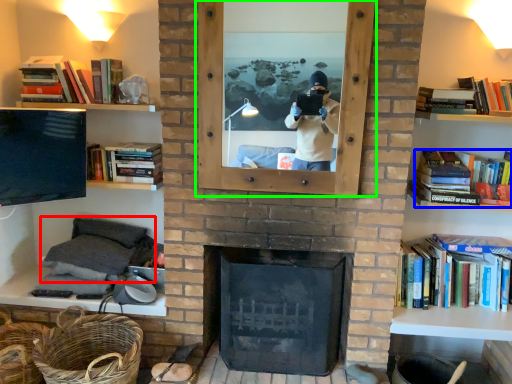
Question: Based on their relative distances, which object is nearer to sit (highlighted by a red box)? Choose from book (highlighted by a blue box) and picture frame (highlighted by a green box).

Choices:
 (A) book
 (B) picture frame

Answer: (B)